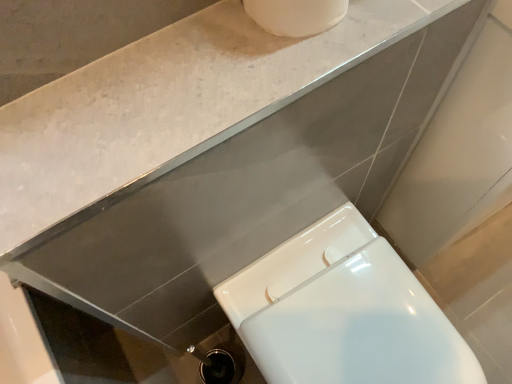
At what (x,y) coordinates should I click in order to perform the action: click on empty space that is ontop of white glossy countertop at upper center (from a real-world perspective). Please return your answer as a coordinate pair (x, y). The image size is (512, 384). Looking at the image, I should click on (195, 72).